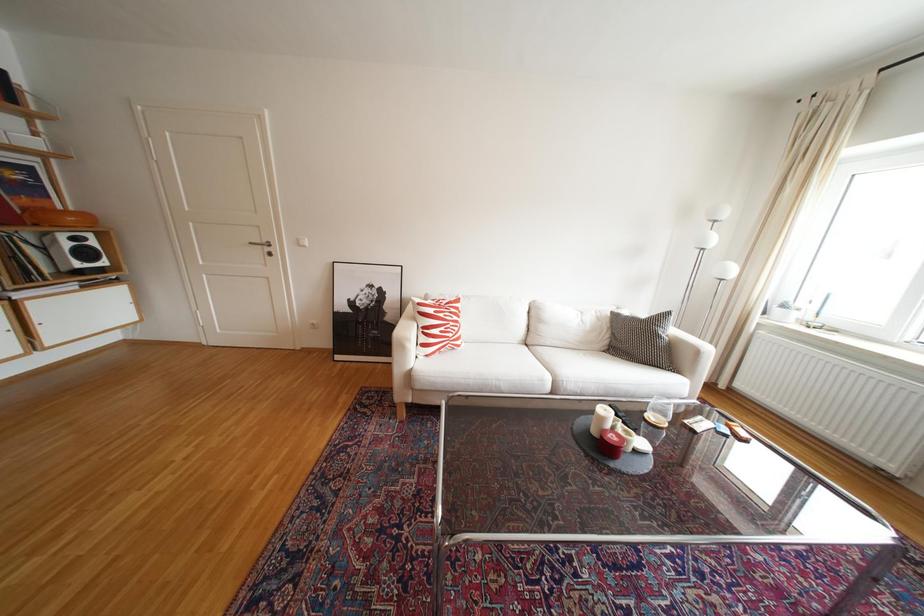
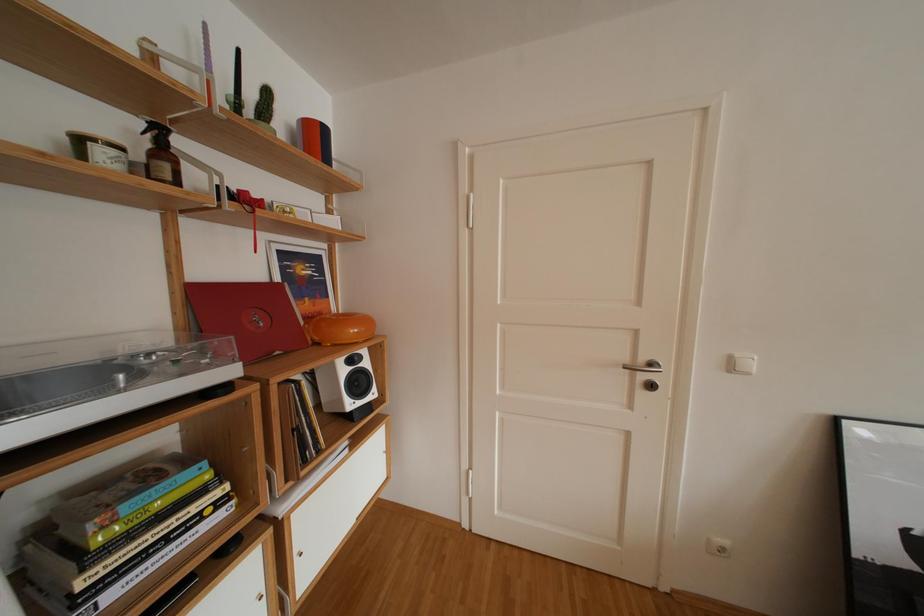
In a continuous first-person perspective shot, in which direction is the camera moving?

The cameraman walked toward left, forward.